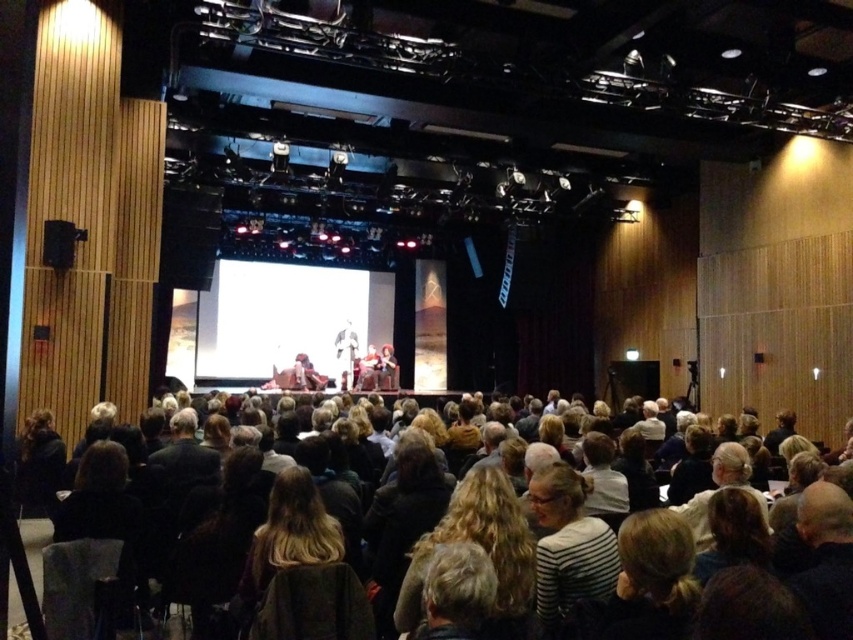
You are sitting in the auditorium and looking at the stage. There are two points marked on the stage floor at coordinates point (549, 504) and point (701, 516). Which point is closer to you?

Point (549, 504) is closer to the viewer than point (701, 516).

You are sitting in the front row of the auditorium and want to take a photo of the striped cotton shirt at lower center and dark brown hair at lower center. Can you fit both of them in the frame of your camera, which has a maximum width of 1.6 meters?

The striped cotton shirt at lower center and dark brown hair at lower center are 1.68 meters apart, so they cannot both fit in the frame since the distance between them exceeds the camera frame width of 1.6 meters.